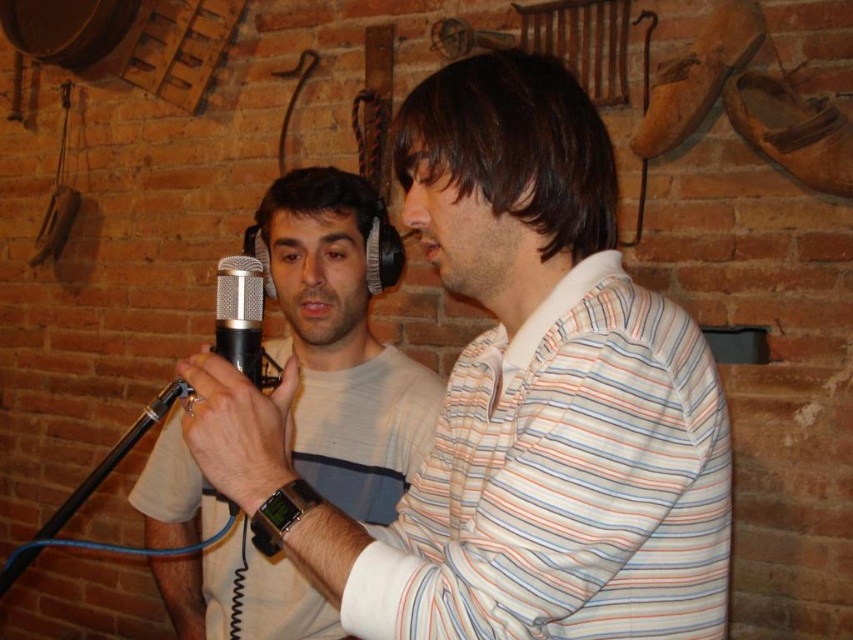
Question: Which point is closer to the camera taking this photo?

Choices:
 (A) (347, 451)
 (B) (248, 333)

Answer: (B)

Question: Which point is farther to the camera?

Choices:
 (A) silver metallic microphone at center
 (B) white striped shirt at center

Answer: (A)

Question: Which point is closer to the camera taking this photo?

Choices:
 (A) (274, 573)
 (B) (408, 112)
 (C) (225, 273)

Answer: (C)

Question: Considering the relative positions of white striped shirt at center and white matte t-shirt at center in the image provided, where is white striped shirt at center located with respect to white matte t-shirt at center?

Choices:
 (A) below
 (B) above

Answer: (B)

Question: Can you confirm if white striped shirt at center is thinner than white matte t-shirt at center?

Choices:
 (A) no
 (B) yes

Answer: (B)

Question: Is white striped shirt at center further to the viewer compared to silver metallic microphone at center?

Choices:
 (A) yes
 (B) no

Answer: (B)